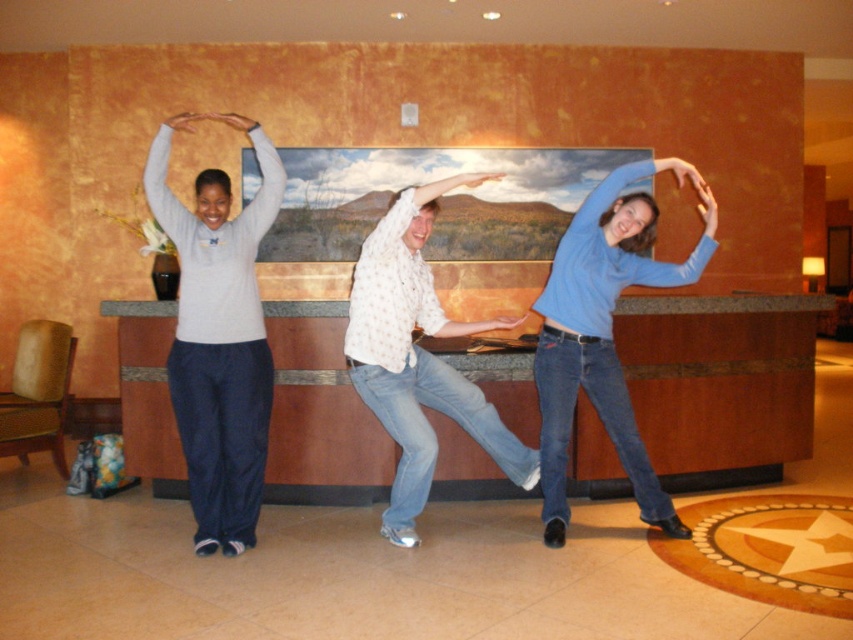
Looking at this image, does blue denim jeans at center appear on the right side of white dotted shirt at center?

Yes, blue denim jeans at center is to the right of white dotted shirt at center.

Is blue denim jeans at center closer to camera compared to white dotted shirt at center?

No, it is behind white dotted shirt at center.

Is point (643, 269) in front of point (367, 390)?

No, (643, 269) is behind (367, 390).

Where is `blue denim jeans at center`? The image size is (853, 640). blue denim jeans at center is located at coordinates (604, 332).

Is point (242, 408) more distant than point (599, 344)?

No, it is in front of (599, 344).

Which of these two, matte gray sweater at left or blue denim jeans at center, stands shorter?

With less height is blue denim jeans at center.

Does point (192, 355) come farther from viewer compared to point (550, 445)?

That is False.

This screenshot has width=853, height=640. I want to click on matte gray sweater at left, so click(219, 337).

Can you confirm if matte gray sweater at left is shorter than white dotted shirt at center?

No, matte gray sweater at left is not shorter than white dotted shirt at center.

Does point (239, 321) lie in front of point (405, 346)?

Yes, point (239, 321) is closer to viewer.

Where is `matte gray sweater at left`? This screenshot has height=640, width=853. matte gray sweater at left is located at coordinates (219, 337).